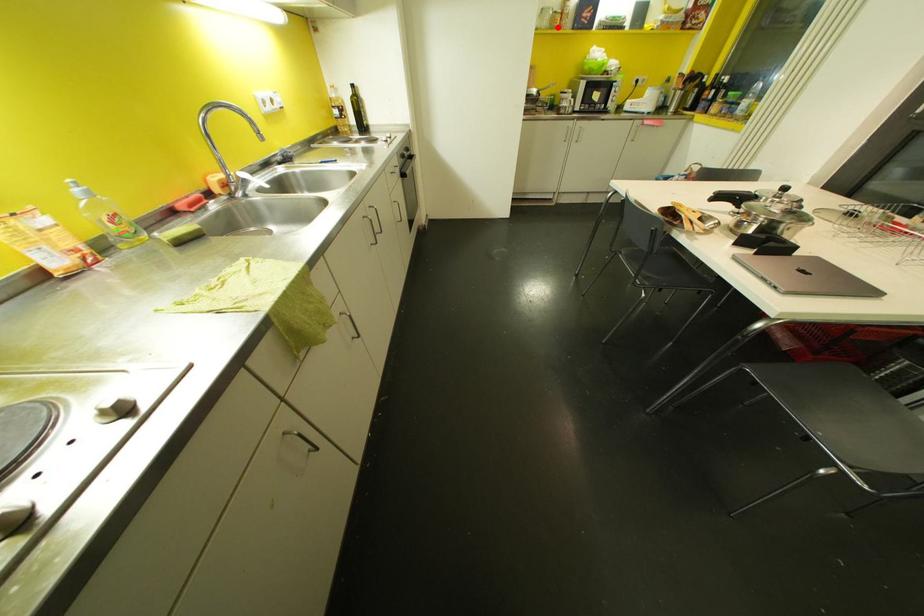
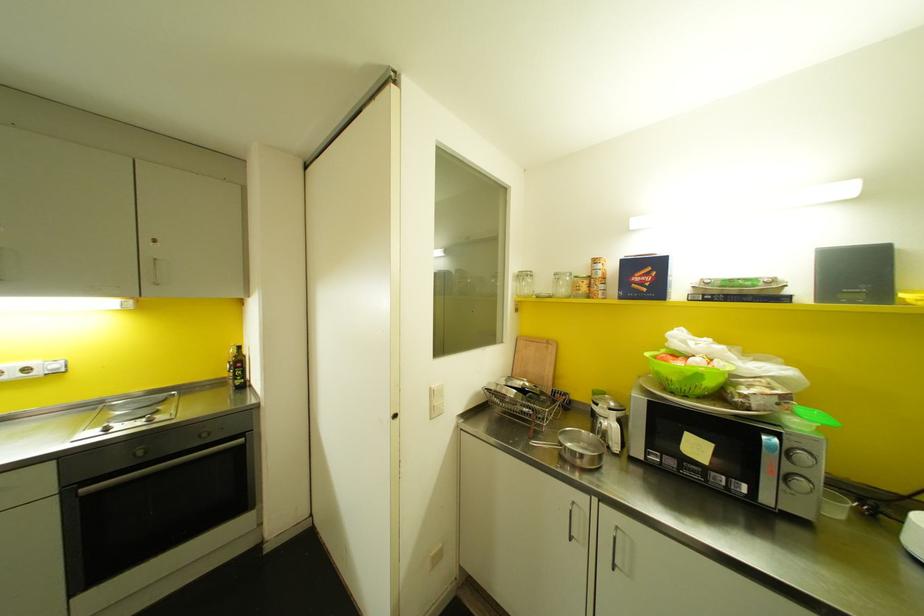
The point at the highlighted location is marked in the first image. Where is the corresponding point in the second image?

(588, 294)